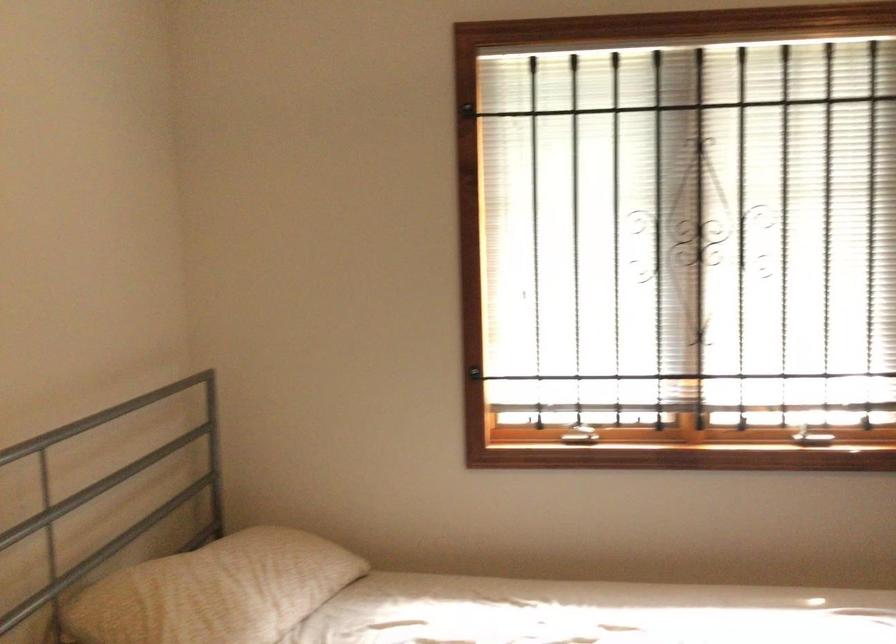
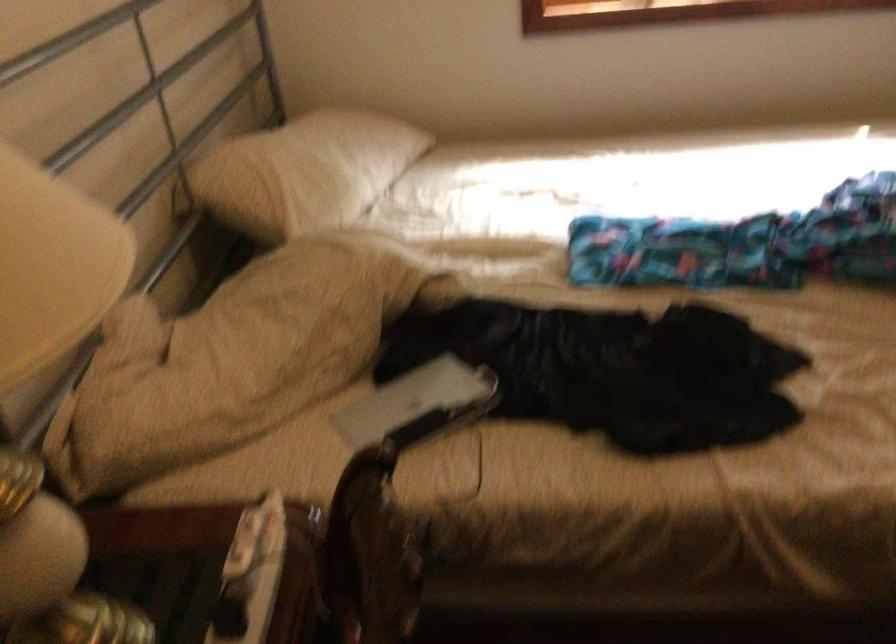
Question: In a continuous first-person perspective shot, in which direction is the camera moving?

Choices:
 (A) Left
 (B) Right
 (C) Forward
 (D) Backward

Answer: (A)